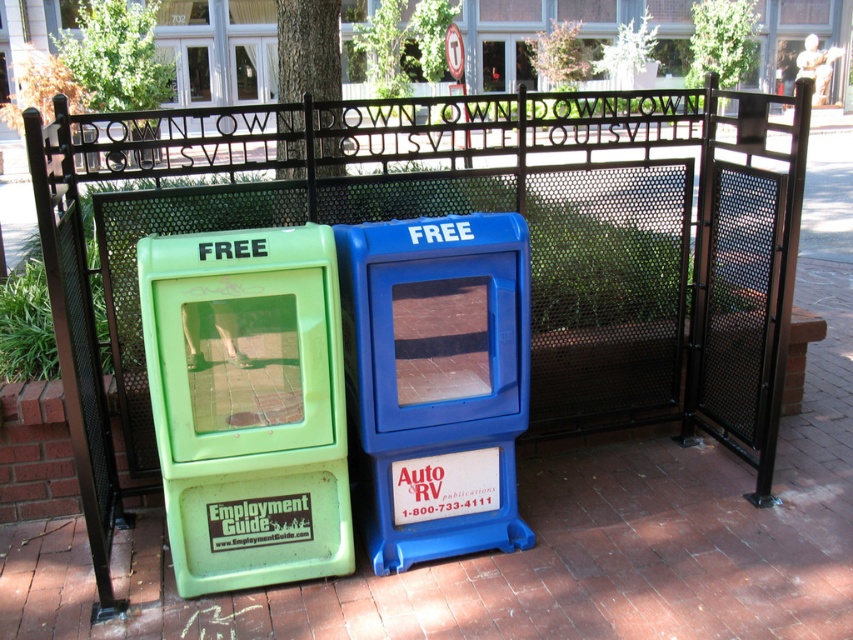
Can you confirm if green plastic employment guide box at left is smaller than blue plastic box at center?

Indeed, green plastic employment guide box at left has a smaller size compared to blue plastic box at center.

Does green plastic employment guide box at left appear over blue plastic box at center?

Actually, green plastic employment guide box at left is below blue plastic box at center.

Identify the location of green plastic employment guide box at left. (248, 404).

Locate an element on the screen. The width and height of the screenshot is (853, 640). green plastic employment guide box at left is located at coordinates (248, 404).